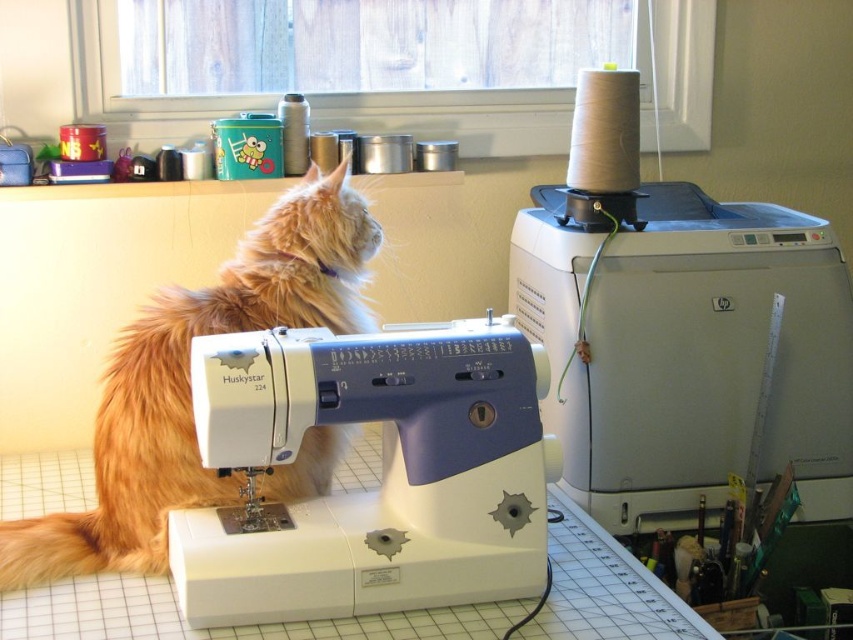
You are organizing a workspace and need to move the white plastic sewing machine at upper right. If you move it forward, will the white plastic sewing machine at center become visible?

The white plastic sewing machine at center is currently behind the white plastic sewing machine at upper right. If you move the white plastic sewing machine at upper right forward, the one at center will no longer be blocked and become visible.

You are a delivery person who needs to place a box between the white plastic sewing machine at center and the fuzzy orange cat at left. The box is 7 inches long. Will it fit in the space between them?

The white plastic sewing machine at center is 6.68 inches away from the fuzzy orange cat at left, so the box that is 7 inches long will not fit between them since it is slightly longer than the available space.

You are standing in a room with a sewing machine and a cat. The sewing machine is located at point (680, 332). If you want to place a new spool of thread on the table near the sewing machine, where should you place it to ensure it is closest to the sewing machine?

The point (680, 332) corresponds to the white plastic sewing machine at upper right, so placing the new spool of thread near that point would ensure it is closest to the sewing machine.